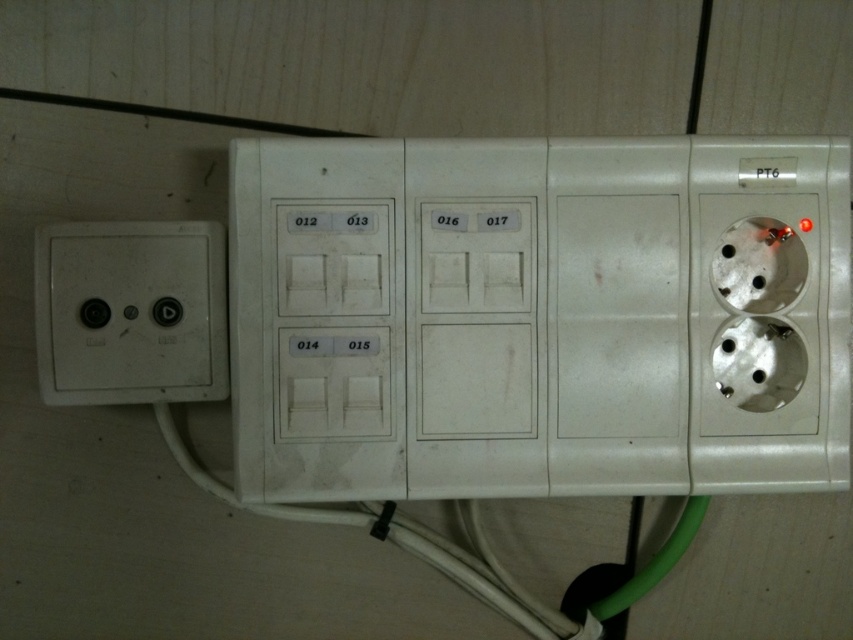
Does white plastic socket at center have a smaller size compared to white matte socket at left?

Incorrect, white plastic socket at center is not smaller in size than white matte socket at left.

Does point (500, 465) come behind point (120, 301)?

Yes, point (500, 465) is behind point (120, 301).

Locate an element on the screen. This screenshot has height=640, width=853. white plastic socket at center is located at coordinates (538, 317).